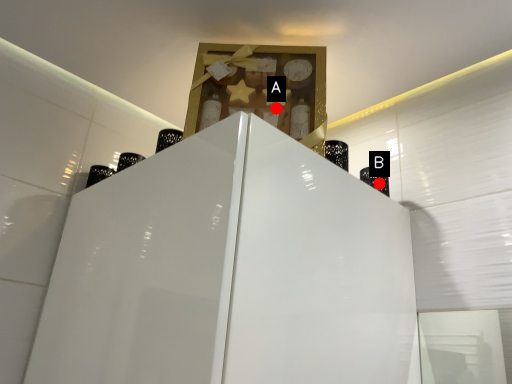
Question: Two points are circled on the image, labeled by A and B beside each circle. Which of the following is the closest to the observer?

Choices:
 (A) A is closer
 (B) B is closer

Answer: (A)